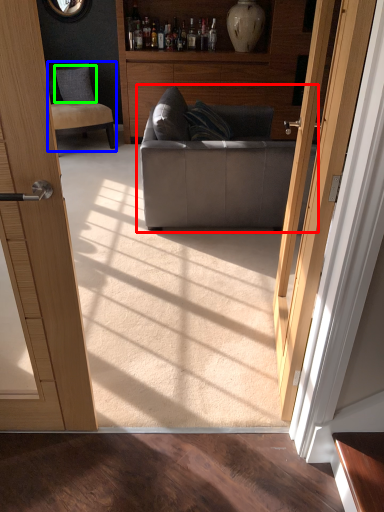
Question: Based on their relative distances, which object is farther from studio couch (highlighted by a red box)? Choose from chair (highlighted by a blue box) and pillow (highlighted by a green box).

Choices:
 (A) chair
 (B) pillow

Answer: (B)